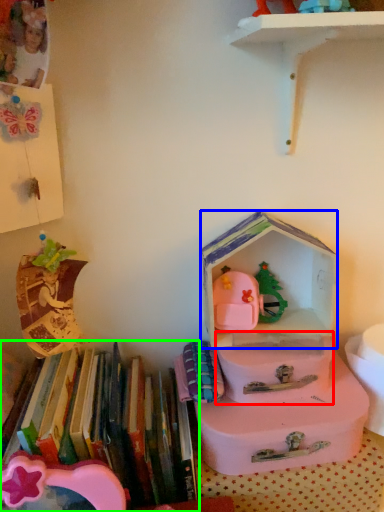
Question: Which object is positioned closest to box (highlighted by a red box)? Select from storage box (highlighted by a blue box) and book (highlighted by a green box).

Choices:
 (A) storage box
 (B) book

Answer: (A)